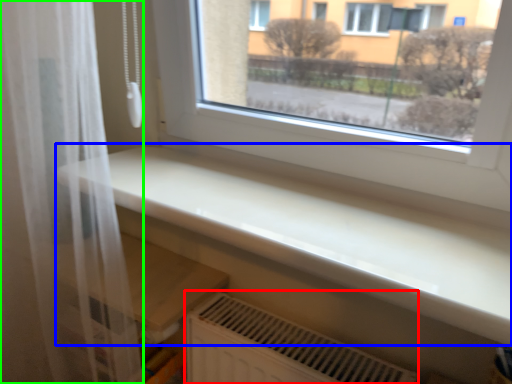
Question: Which object is the closest to the air conditioning (highlighted by a red box)? Choose among these: counter top (highlighted by a blue box) or shower curtain (highlighted by a green box).

Choices:
 (A) counter top
 (B) shower curtain

Answer: (A)